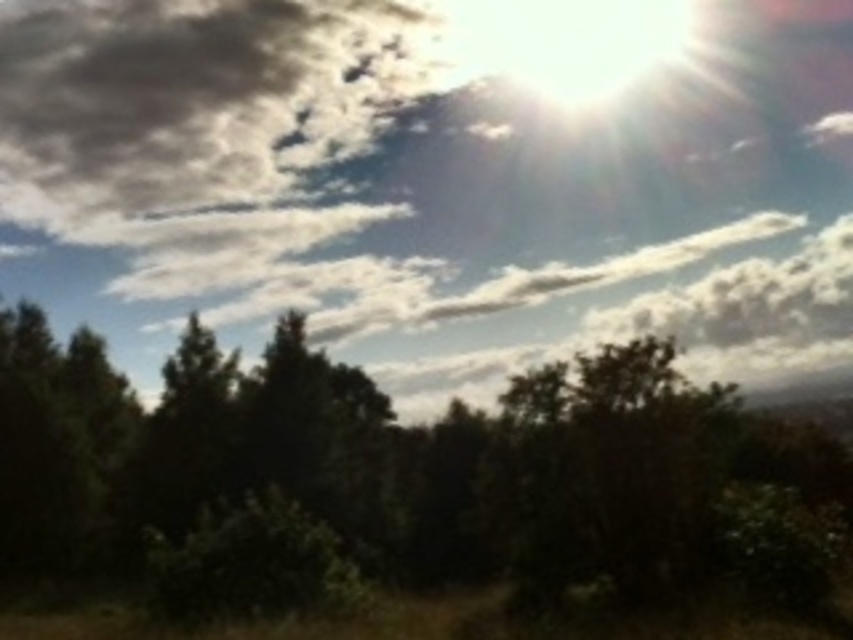
Question: Which object is closer to the camera taking this photo?

Choices:
 (A) dark gray fluffy cloud at upper left
 (B) white fluffy cloud at upper center

Answer: (B)

Question: Observing the image, what is the correct spatial positioning of white fluffy cloud at upper center in reference to green leafy tree at center?

Choices:
 (A) above
 (B) below

Answer: (A)

Question: Among these objects, which one is farthest from the camera?

Choices:
 (A) dark gray fluffy cloud at upper left
 (B) white fluffy cloud at upper center
 (C) green leafy tree at center

Answer: (A)

Question: Which object is farther from the camera taking this photo?

Choices:
 (A) green leafy tree at center
 (B) dark gray fluffy cloud at upper left
 (C) white fluffy cloud at upper center

Answer: (B)

Question: Is green leafy tree at center bigger than dark gray fluffy cloud at upper left?

Choices:
 (A) no
 (B) yes

Answer: (A)

Question: Is white fluffy cloud at upper center thinner than green leafy tree at center?

Choices:
 (A) yes
 (B) no

Answer: (B)